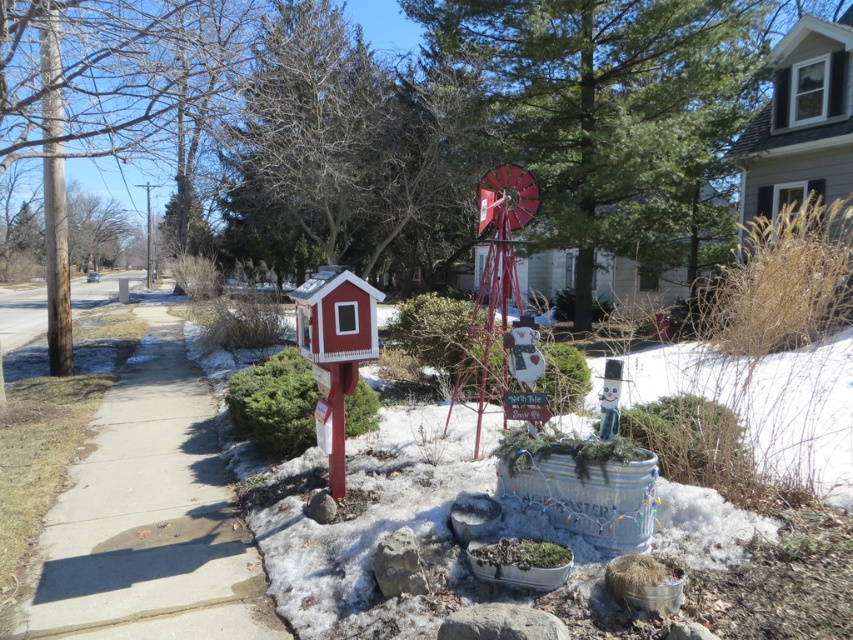
Question: Does concrete sidewalk at center appear over brown wood pole at left?

Choices:
 (A) no
 (B) yes

Answer: (A)

Question: Among these objects, which one is nearest to the camera?

Choices:
 (A) brown wood pole at left
 (B) concrete sidewalk at center

Answer: (B)

Question: Does concrete sidewalk at center appear over brown wood pole at left?

Choices:
 (A) no
 (B) yes

Answer: (A)

Question: Observing the image, what is the correct spatial positioning of concrete sidewalk at center in reference to brown wood pole at left?

Choices:
 (A) left
 (B) right

Answer: (B)

Question: Which point is closer to the camera taking this photo?

Choices:
 (A) (65, 576)
 (B) (62, 301)

Answer: (A)